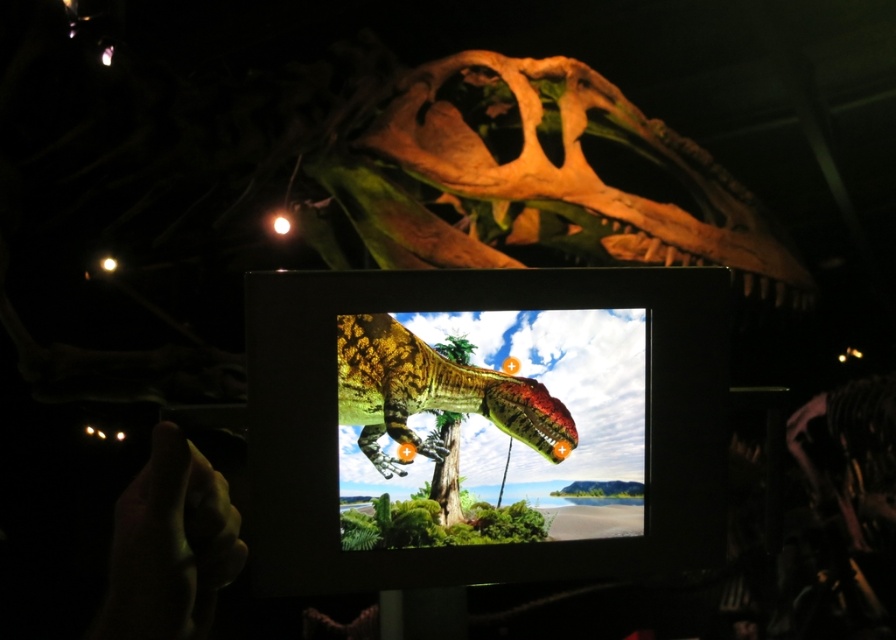
Does shiny plastic screen at center have a smaller size compared to shiny green dinosaur at center?

No.

Locate an element on the screen. The width and height of the screenshot is (896, 640). shiny plastic screen at center is located at coordinates (484, 424).

What do you see at coordinates (484, 424) in the screenshot? I see `shiny plastic screen at center` at bounding box center [484, 424].

This screenshot has width=896, height=640. I want to click on shiny plastic screen at center, so point(484,424).

Does brown bone skull at upper center have a larger size compared to smooth skin hand at lower left?

Yes.

Which is above, brown bone skull at upper center or smooth skin hand at lower left?

Positioned higher is brown bone skull at upper center.

Who is more distant from viewer, (702,193) or (188,612)?

The point (702,193) is behind.

At what (x,y) coordinates should I click in order to perform the action: click on brown bone skull at upper center. Please return your answer as a coordinate pair (x, y). This screenshot has height=640, width=896. Looking at the image, I should click on (539, 177).

Is brown bone skull at upper center above shiny green dinosaur at center?

Yes.

Does brown bone skull at upper center have a lesser height compared to shiny green dinosaur at center?

In fact, brown bone skull at upper center may be taller than shiny green dinosaur at center.

Is point (588, 214) more distant than point (352, 314)?

Yes, it is.

Image resolution: width=896 pixels, height=640 pixels. Identify the location of brown bone skull at upper center. (539, 177).